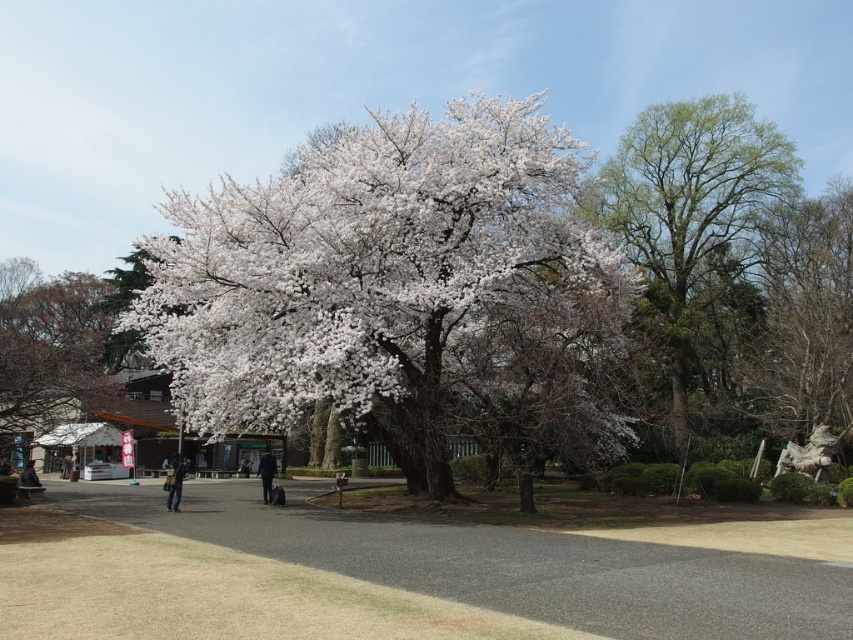
Question: Is bare brown branches at upper right closer to camera compared to white blossoming tree at left?

Choices:
 (A) yes
 (B) no

Answer: (B)

Question: Among these objects, which one is nearest to the camera?

Choices:
 (A) white matte flower at center
 (B) bare brown branches at upper right
 (C) dark blue fabric coat at center

Answer: (A)

Question: Observing the image, what is the correct spatial positioning of white matte flower at center in reference to denim jacket at lower left?

Choices:
 (A) left
 (B) right

Answer: (A)

Question: Is white blossoming tree at left behind dark blue fabric coat at center?

Choices:
 (A) yes
 (B) no

Answer: (B)

Question: Which point appears farthest from the camera in this image?

Choices:
 (A) tap(167, 500)
 (B) tap(91, 353)

Answer: (B)

Question: Among these points, which one is farthest from the camera?

Choices:
 (A) (167, 497)
 (B) (650, 220)
 (C) (10, 280)

Answer: (C)